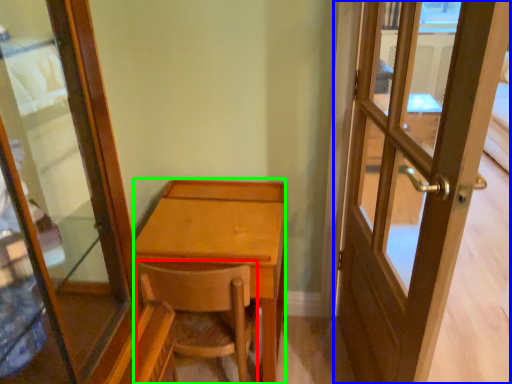
Question: Estimate the real-world distances between objects in this image. Which object is farther from chair (highlighted by a red box), door (highlighted by a blue box) or desk (highlighted by a green box)?

Choices:
 (A) door
 (B) desk

Answer: (A)